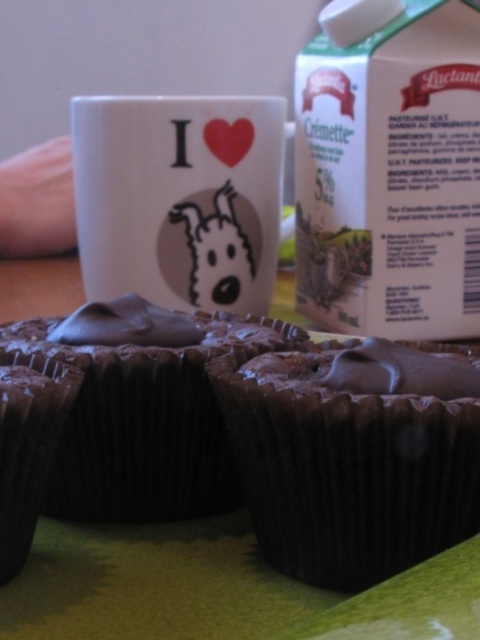
Question: Is chocolate matte muffin at center smaller than chocolate matte cupcake at lower left?

Choices:
 (A) no
 (B) yes

Answer: (A)

Question: Does white matte mug at center have a greater width compared to chocolate matte cupcake at center?

Choices:
 (A) yes
 (B) no

Answer: (A)

Question: Estimate the real-world distances between objects in this image. Which object is farther from the chocolate matte muffin at center?

Choices:
 (A) chocolate paper cupcake at center
 (B) chocolate matte cupcake at lower left

Answer: (B)

Question: Is chocolate matte cupcake at center thinner than chocolate matte cupcake at lower left?

Choices:
 (A) no
 (B) yes

Answer: (A)

Question: Among these points, which one is nearest to the camera?

Choices:
 (A) (184, 122)
 (B) (14, 449)
 (C) (201, 364)

Answer: (B)

Question: Considering the real-world distances, which object is closest to the chocolate matte cupcake at lower left?

Choices:
 (A) chocolate matte muffin at center
 (B) chocolate paper cupcake at center

Answer: (A)